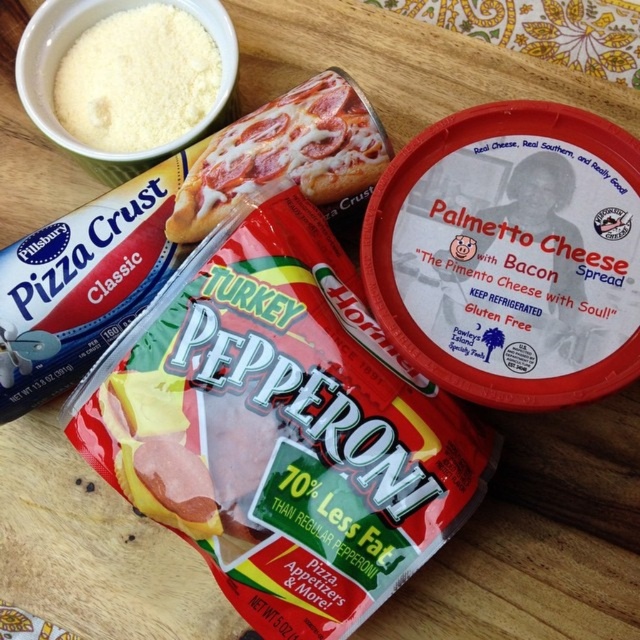
Question: Which point is closer to the camera?

Choices:
 (A) white powder at upper left
 (B) shiny metallic pizza at center

Answer: (B)

Question: Does shiny metallic pizza at center appear over white powder at upper left?

Choices:
 (A) no
 (B) yes

Answer: (A)

Question: Which object appears closest to the camera in this image?

Choices:
 (A) white powder at upper left
 (B) shiny metallic pizza at center

Answer: (B)

Question: Is shiny metallic pizza at center to the left of white powder at upper left from the viewer's perspective?

Choices:
 (A) yes
 (B) no

Answer: (B)

Question: Is shiny metallic pizza at center smaller than white powder at upper left?

Choices:
 (A) yes
 (B) no

Answer: (B)